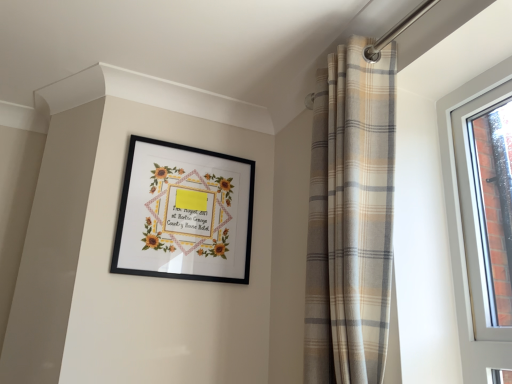
Question: In terms of width, does beige plaid curtain at upper right look wider or thinner when compared to black matte picture frame at upper center?

Choices:
 (A) thin
 (B) wide

Answer: (B)

Question: Is point (389, 279) closer or farther from the camera than point (189, 236)?

Choices:
 (A) closer
 (B) farther

Answer: (A)

Question: Looking at the image, does beige plaid curtain at upper right seem bigger or smaller compared to black matte picture frame at upper center?

Choices:
 (A) small
 (B) big

Answer: (B)

Question: From the image's perspective, is black matte picture frame at upper center located above or below beige plaid curtain at upper right?

Choices:
 (A) below
 (B) above

Answer: (A)

Question: From a real-world perspective, relative to beige plaid curtain at upper right, is black matte picture frame at upper center vertically above or below?

Choices:
 (A) below
 (B) above

Answer: (B)

Question: Is black matte picture frame at upper center wider or thinner than beige plaid curtain at upper right?

Choices:
 (A) wide
 (B) thin

Answer: (B)

Question: Based on their sizes in the image, would you say black matte picture frame at upper center is bigger or smaller than beige plaid curtain at upper right?

Choices:
 (A) small
 (B) big

Answer: (A)